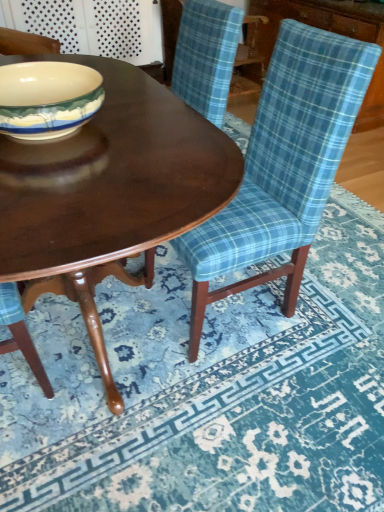
Question: Choose the correct answer: Is blue plaid fabric at lower right inside matte ceramic bowl at center-left or outside it?

Choices:
 (A) inside
 (B) outside

Answer: (B)

Question: Considering their positions, is blue plaid fabric at lower right located in front of or behind matte ceramic bowl at center-left?

Choices:
 (A) behind
 (B) front

Answer: (B)

Question: Which of these objects is positioned closest to the blue plaid fabric at lower right?

Choices:
 (A) shiny dark wood coffee table at center
 (B) matte ceramic bowl at center-left
 (C) blue plaid fabric chair at center

Answer: (C)

Question: Estimate the real-world distances between objects in this image. Which object is closer to the blue plaid fabric chair at center?

Choices:
 (A) matte ceramic bowl at center-left
 (B) shiny dark wood coffee table at center
 (C) blue plaid fabric at lower right

Answer: (B)